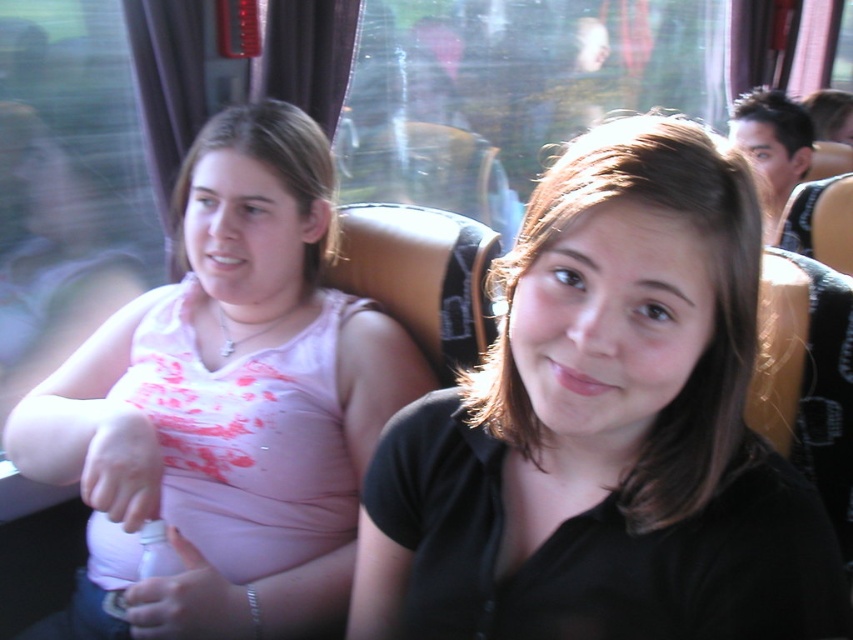
Question: Is black matte shirt at center behind pink matte tank top at center?

Choices:
 (A) no
 (B) yes

Answer: (A)

Question: Which point is farther to the camera?

Choices:
 (A) (607, 264)
 (B) (331, 300)

Answer: (B)

Question: Which point is farther to the camera?

Choices:
 (A) (70, 467)
 (B) (573, 328)

Answer: (A)

Question: Which point appears farthest from the camera in this image?

Choices:
 (A) (804, 563)
 (B) (51, 436)

Answer: (B)

Question: Is the position of black matte shirt at center less distant than that of pink matte tank top at center?

Choices:
 (A) yes
 (B) no

Answer: (A)

Question: Does black matte shirt at center have a greater width compared to pink matte tank top at center?

Choices:
 (A) no
 (B) yes

Answer: (A)